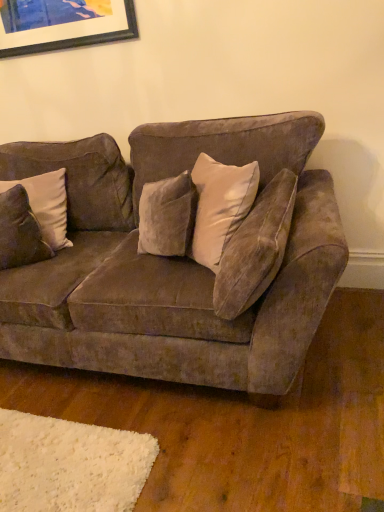
Question: Should I look upward or downward to see velvet brown pillow at left?

Choices:
 (A) up
 (B) down

Answer: (A)

Question: Does velvet brown pillow at left lie in front of matte black picture frame at upper left?

Choices:
 (A) no
 (B) yes

Answer: (B)

Question: Does velvet brown pillow at left lie behind matte black picture frame at upper left?

Choices:
 (A) no
 (B) yes

Answer: (A)

Question: Is velvet brown pillow at left next to matte black picture frame at upper left and touching it?

Choices:
 (A) yes
 (B) no

Answer: (B)

Question: From a real-world perspective, is velvet brown pillow at left positioned under matte black picture frame at upper left based on gravity?

Choices:
 (A) no
 (B) yes

Answer: (B)

Question: Is matte black picture frame at upper left completely or partially inside velvet brown pillow at left?

Choices:
 (A) no
 (B) yes

Answer: (A)

Question: Is velvet brown pillow at left to the left of matte black picture frame at upper left from the viewer's perspective?

Choices:
 (A) yes
 (B) no

Answer: (A)

Question: Considering the relative sizes of velvet brown couch at center and matte black picture frame at upper left in the image provided, is velvet brown couch at center taller than matte black picture frame at upper left?

Choices:
 (A) no
 (B) yes

Answer: (B)

Question: Is velvet brown couch at center at the right side of matte black picture frame at upper left?

Choices:
 (A) yes
 (B) no

Answer: (A)

Question: Considering the relative positions of velvet brown couch at center and matte black picture frame at upper left in the image provided, is velvet brown couch at center in front of matte black picture frame at upper left?

Choices:
 (A) yes
 (B) no

Answer: (A)

Question: Is velvet brown couch at center not close to matte black picture frame at upper left?

Choices:
 (A) no
 (B) yes

Answer: (A)

Question: Can you confirm if velvet brown couch at center is bigger than matte black picture frame at upper left?

Choices:
 (A) yes
 (B) no

Answer: (A)

Question: Is velvet brown couch at center behind matte black picture frame at upper left?

Choices:
 (A) no
 (B) yes

Answer: (A)

Question: Is velvet brown couch at center facing away from velvet brown pillow at left?

Choices:
 (A) yes
 (B) no

Answer: (A)